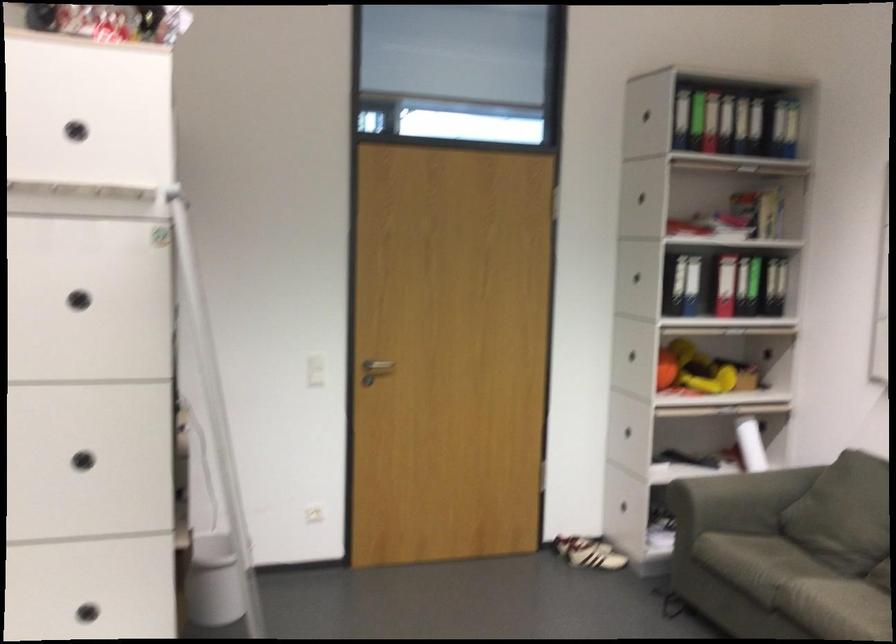
Identify the location of metal door handle. Image resolution: width=896 pixels, height=644 pixels. (374, 370).